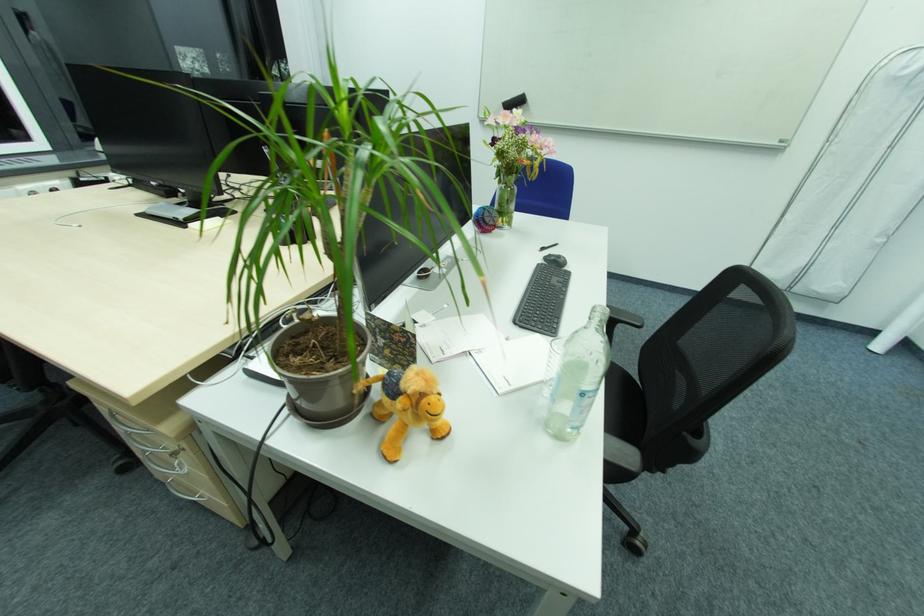
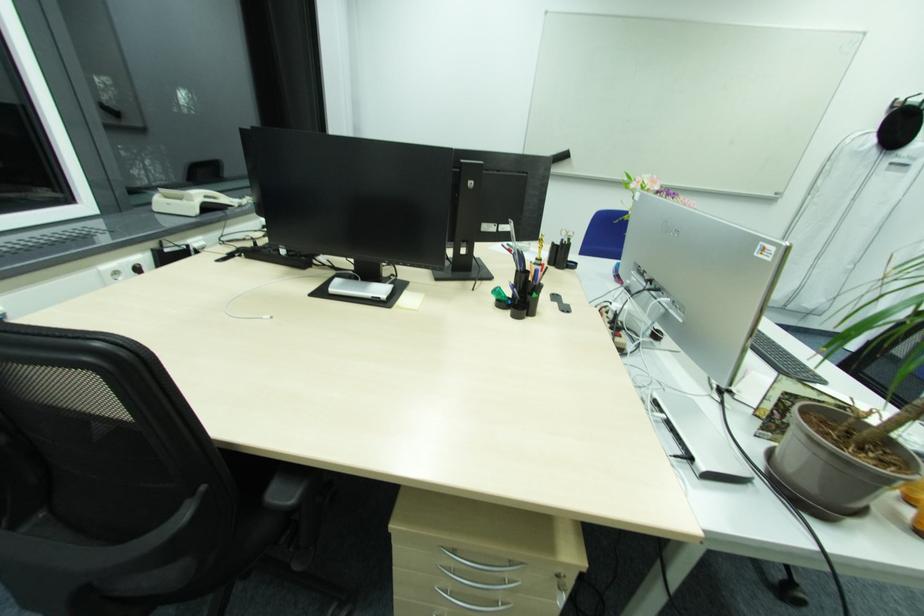
Question: The images are taken continuously from a first-person perspective. In which direction are you moving?

Choices:
 (A) Left
 (B) Right
 (C) Forward
 (D) Backward

Answer: (A)